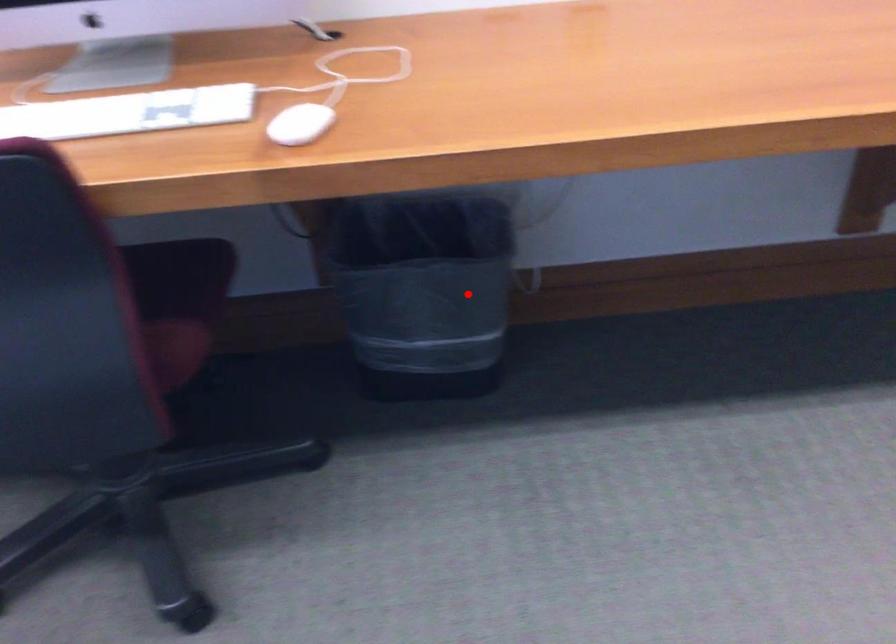
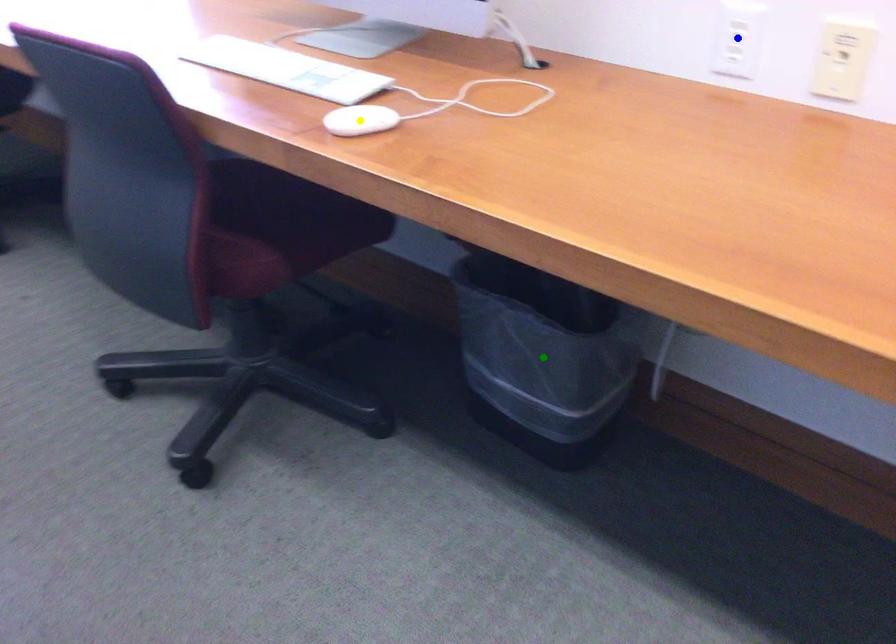
Question: I am providing you with two images of the same scene from different viewpoints. A red point is marked on the first image. You are given multiple points on the second image. Which mark in image 2 goes with the point in image 1?

Choices:
 (A) green point
 (B) yellow point
 (C) blue point

Answer: (A)